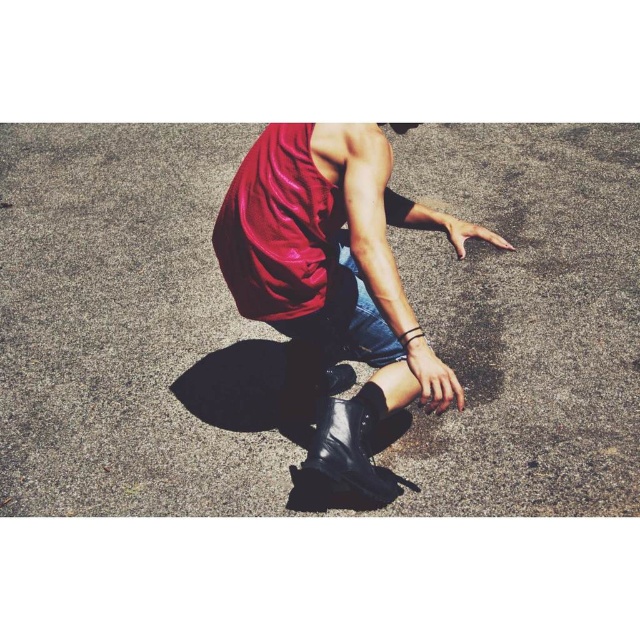
From the picture: Which is more to the right, shiny red tank top at center or black leather boot at lower center?

Positioned to the right is shiny red tank top at center.

Does shiny red tank top at center have a lesser height compared to black leather boot at lower center?

No.

Does point (241, 212) lie in front of point (316, 433)?

Yes, it is in front of point (316, 433).

Identify the location of shiny red tank top at center. The width and height of the screenshot is (640, 640). point(336,278).